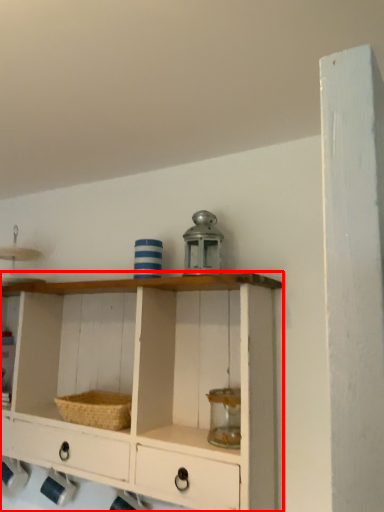
Question: From the image's perspective, what is the correct spatial positioning of shelf (annotated by the red box) in reference to basket?

Choices:
 (A) above
 (B) below

Answer: (A)